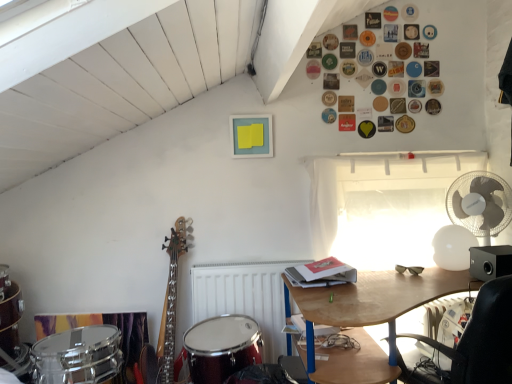
The image size is (512, 384). I want to click on free space above white sheer curtain at upper right (from a real-world perspective), so click(x=402, y=146).